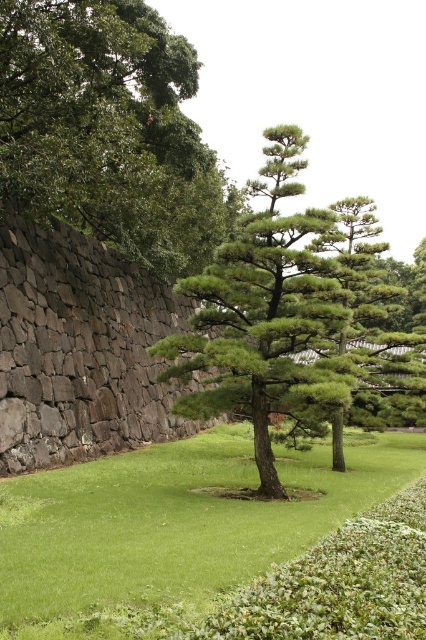
Is green leafy tree at upper left positioned before green needle-like at center?

No, it is behind green needle-like at center.

Does green leafy tree at upper left appear on the right side of green needle-like at center?

Incorrect, green leafy tree at upper left is not on the right side of green needle-like at center.

This screenshot has height=640, width=426. In order to click on green leafy tree at upper left in this screenshot , I will do `click(109, 131)`.

Can you confirm if green grass at center is positioned above green textured pine tree at center?

No, green grass at center is not above green textured pine tree at center.

Does green grass at center appear on the right side of green textured pine tree at center?

No, green grass at center is not to the right of green textured pine tree at center.

Measure the distance between point (230,435) and camera.

Point (230,435) is 84.42 feet from camera.

I want to click on green grass at center, so click(172, 529).

Does green needle-like at center have a greater height compared to green textured pine tree at center?

In fact, green needle-like at center may be shorter than green textured pine tree at center.

Is point (273, 484) less distant than point (334, 205)?

Yes, point (273, 484) is in front of point (334, 205).

I want to click on green needle-like at center, so click(278, 316).